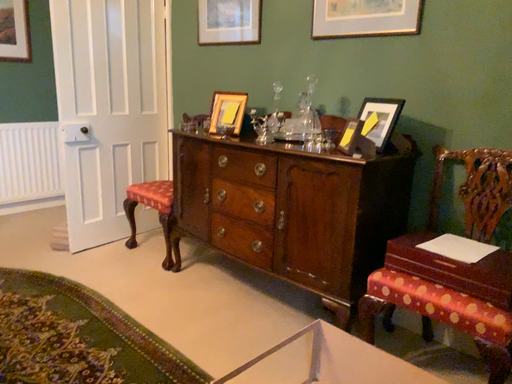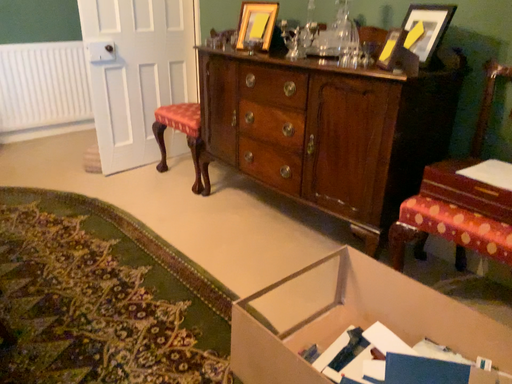
Question: How did the camera likely rotate when shooting the video?

Choices:
 (A) rotated downward
 (B) rotated upward

Answer: (A)